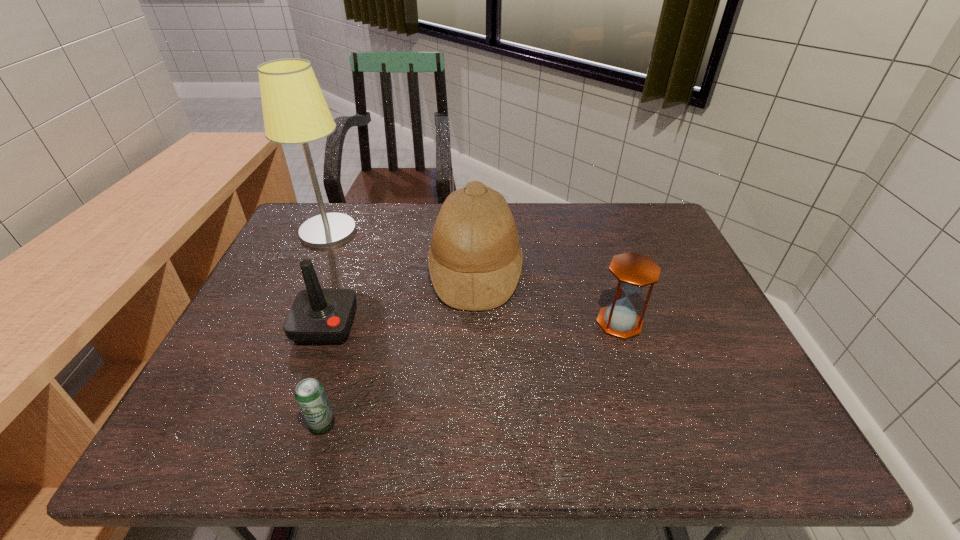
Where is `empty space that is in between the rightmost object and the hat`? Image resolution: width=960 pixels, height=540 pixels. empty space that is in between the rightmost object and the hat is located at coordinates (547, 296).

I want to click on empty space that is in between the hourglass and the joystick, so click(472, 324).

The width and height of the screenshot is (960, 540). What are the coordinates of `object that is the second closest one to the tallest object` in the screenshot? It's located at (475, 260).

Identify which object is the third closest to the hourglass. Please provide its 2D coordinates. Your answer should be formatted as a tuple, i.e. [(x, y)], where the tuple contains the x and y coordinates of a point satisfying the conditions above.

[(310, 395)]

Identify the location of vacant space that satisfies the following two spatial constraints: 1. on the back side of the hourglass; 2. on the front-facing side of the hat. This screenshot has width=960, height=540. (603, 271).

Image resolution: width=960 pixels, height=540 pixels. I want to click on free spot that satisfies the following two spatial constraints: 1. on the front-facing side of the second object from right to left; 2. on the right side of the hourglass, so click(x=475, y=322).

You are a GUI agent. You are given a task and a screenshot of the screen. Output one action in this format:
    pyautogui.click(x=<x>, y=<y>)
    Task: Click on the vacant area that satisfies the following two spatial constraints: 1. on the front-facing side of the second tallest object; 2. on the right side of the rightmost object
    This screenshot has width=960, height=540.
    Given the screenshot: What is the action you would take?
    pyautogui.click(x=475, y=322)

Locate an element on the screen. The width and height of the screenshot is (960, 540). vacant space that satisfies the following two spatial constraints: 1. on the front-facing side of the hat; 2. on the front side of the shortest object is located at coordinates (473, 424).